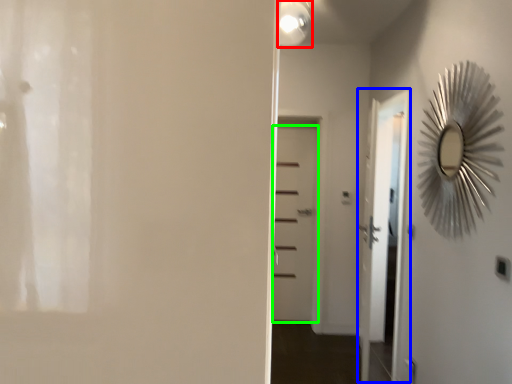
Question: Which is nearer to the light fixture (highlighted by a red box)? screen door (highlighted by a blue box) or door (highlighted by a green box).

Choices:
 (A) screen door
 (B) door

Answer: (B)